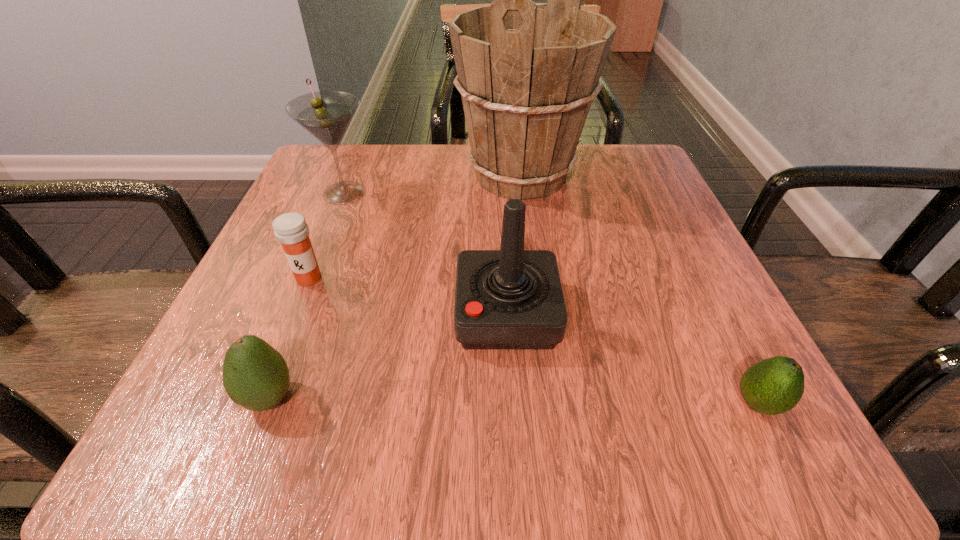
Find the location of `free location located 0.290m on the front-facing side of the joystick`. free location located 0.290m on the front-facing side of the joystick is located at coordinates (260, 314).

At what (x,y) coordinates should I click in order to perform the action: click on vacant region located 0.270m on the front-facing side of the joystick. Please return your answer as a coordinate pair (x, y). The image size is (960, 540). Looking at the image, I should click on (274, 314).

Identify the location of free space located on the label side of the medicine. The width and height of the screenshot is (960, 540). (277, 357).

I want to click on vacant space located 0.210m on the back of the left avocado, so click(320, 265).

Find the location of a particular element. This screenshot has width=960, height=540. blank space located on the left of the right avocado is located at coordinates (514, 403).

I want to click on bucket located in the far edge section of the desktop, so click(x=527, y=73).

Where is `martini at the far edge`? The image size is (960, 540). martini at the far edge is located at coordinates (326, 115).

Where is `martini located at the left edge`? martini located at the left edge is located at coordinates (326, 115).

At what (x,y) coordinates should I click in order to perform the action: click on medicine situated at the left edge. Please return your answer as a coordinate pair (x, y). The height and width of the screenshot is (540, 960). Looking at the image, I should click on (291, 230).

Identify the location of avocado that is at the left edge. This screenshot has width=960, height=540. (255, 376).